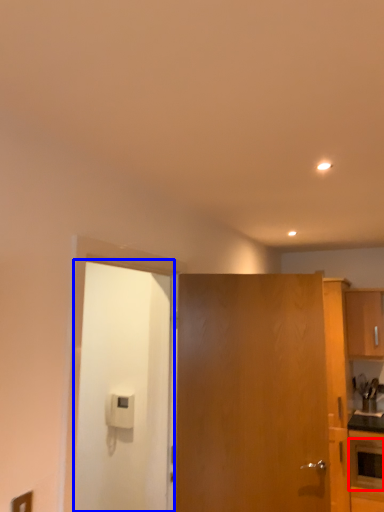
Question: Which object is further to the camera taking this photo, appliance (highlighted by a red box) or door (highlighted by a blue box)?

Choices:
 (A) appliance
 (B) door

Answer: (A)